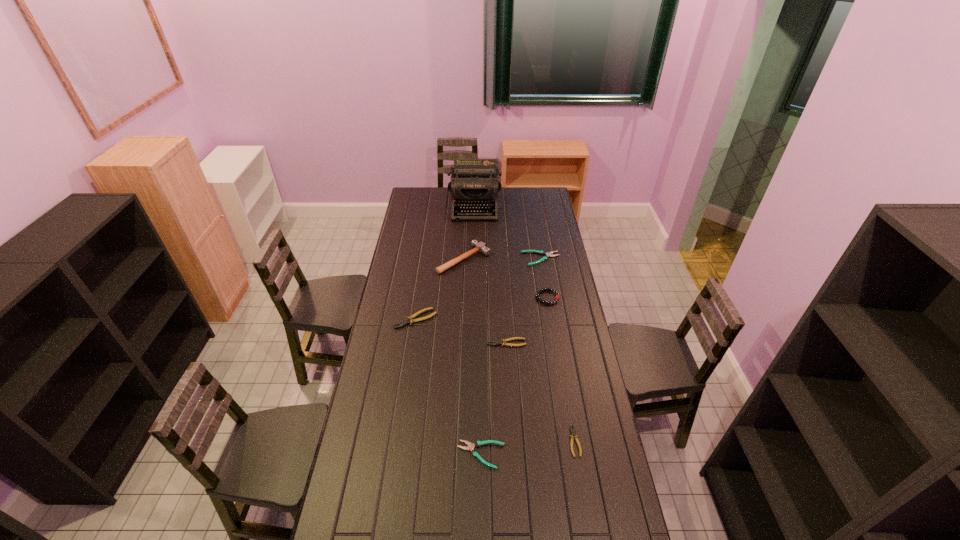
Locate an element on the screen. The image size is (960, 540). the closest yellow pliers to the right teal pliers is located at coordinates (504, 341).

Locate which yellow pliers is the closest to the seventh shortest object. Please provide its 2D coordinates. Your answer should be formatted as a tuple, i.e. [(x, y)], where the tuple contains the x and y coordinates of a point satisfying the conditions above.

[(410, 319)]

Where is `the second closest teal pliers to the second smallest yellow pliers`? The width and height of the screenshot is (960, 540). the second closest teal pliers to the second smallest yellow pliers is located at coordinates (549, 254).

Identify the location of vacant space that satisfies the following two spatial constraints: 1. on the keyboard of the third tallest object; 2. on the left side of the tallest object. (473, 298).

Find the location of a particular element. This screenshot has height=540, width=960. free space in the image that satisfies the following two spatial constraints: 1. on the front side of the fourth farthest object; 2. on the left side of the farther teal pliers is located at coordinates (547, 298).